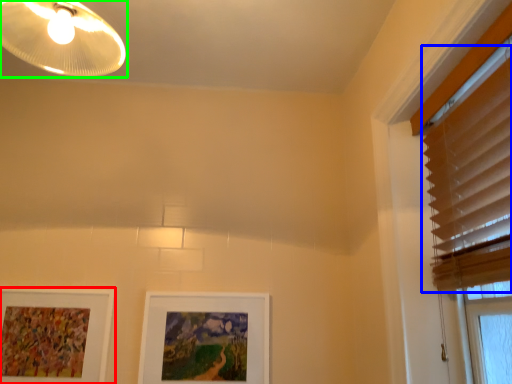
Question: Which object is the farthest from picture frame (highlighted by a red box)? Choose among these: blind (highlighted by a blue box) or lamp (highlighted by a green box).

Choices:
 (A) blind
 (B) lamp

Answer: (A)